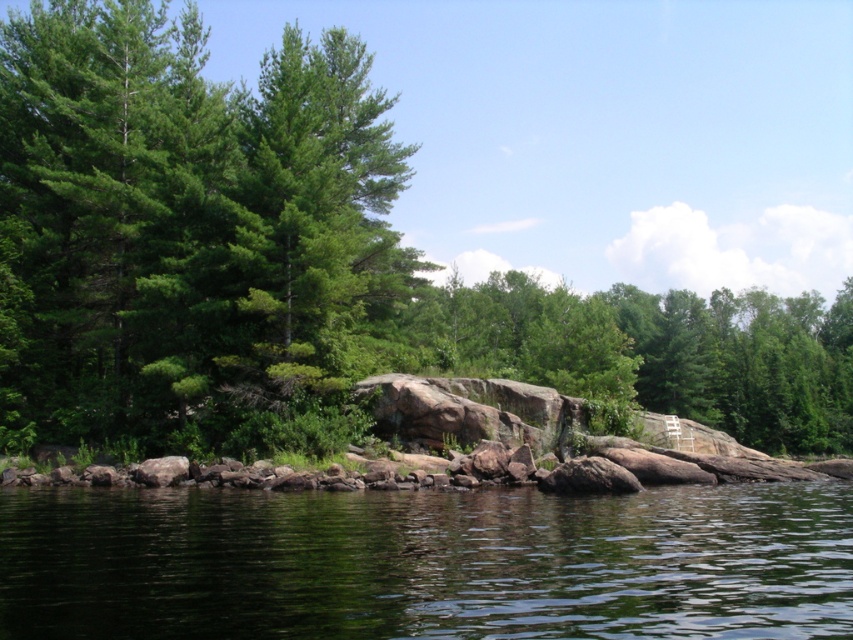
You are standing on the shore looking at the transparent water at lower center and the green matte tree at center. Which object is closer to you?

The transparent water at lower center is closer to you because it is in front of the green matte tree at center.